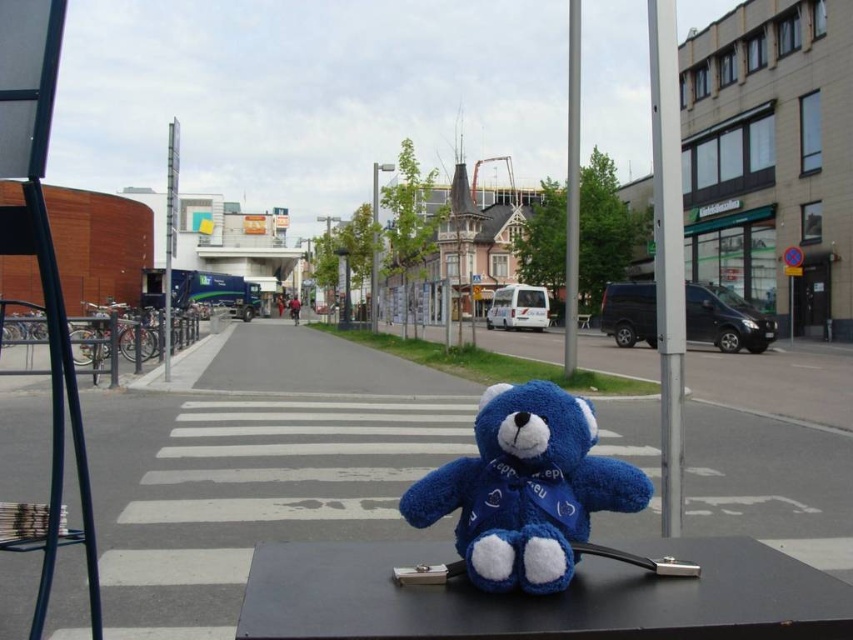
Question: Which object is farther from the camera taking this photo?

Choices:
 (A) metallic silver pole at center
 (B) velvety blue teddy bear at center
 (C) blue plush bear at center

Answer: (A)

Question: Where is silver metallic pole at right located in relation to metallic pole at upper center in the image?

Choices:
 (A) below
 (B) above

Answer: (A)

Question: Is blue plush bear at center bigger than metallic silver pole at center?

Choices:
 (A) no
 (B) yes

Answer: (A)

Question: Is the position of blue plush bear at center more distant than that of metallic pole at upper center?

Choices:
 (A) no
 (B) yes

Answer: (A)

Question: Which object is positioned farthest from the metallic silver pole at center?

Choices:
 (A) silver metallic pole at center
 (B) silver metallic pole at right
 (C) velvety blue teddy bear at center
 (D) blue plush bear at center

Answer: (C)

Question: Which point appears farthest from the camera in this image?

Choices:
 (A) (572, 397)
 (B) (573, 97)
 (C) (373, 321)
 (D) (253, 561)

Answer: (C)